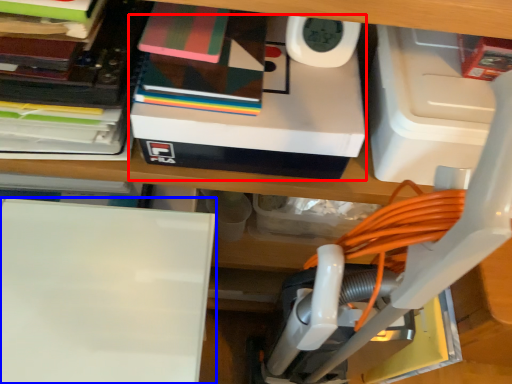
Question: Which object appears farthest to the camera in this image, box (highlighted by a red box) or wide (highlighted by a blue box)?

Choices:
 (A) box
 (B) wide

Answer: (A)